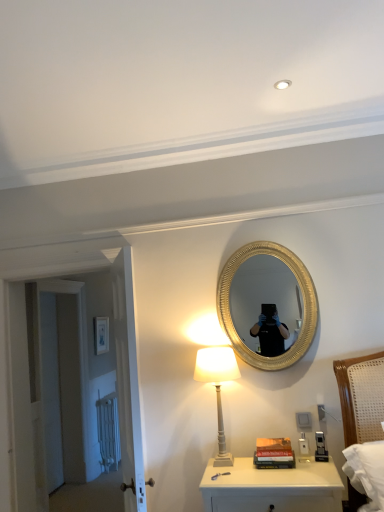
Identify the location of vacant area that lies to the right of hardcover books at center. (316, 459).